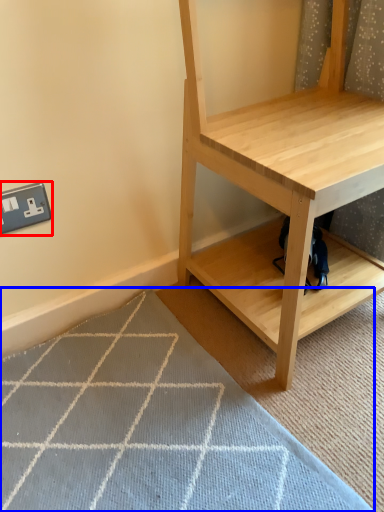
Question: Which point is further to the camera, electric outlet (highlighted by a red box) or doormat (highlighted by a blue box)?

Choices:
 (A) electric outlet
 (B) doormat

Answer: (A)